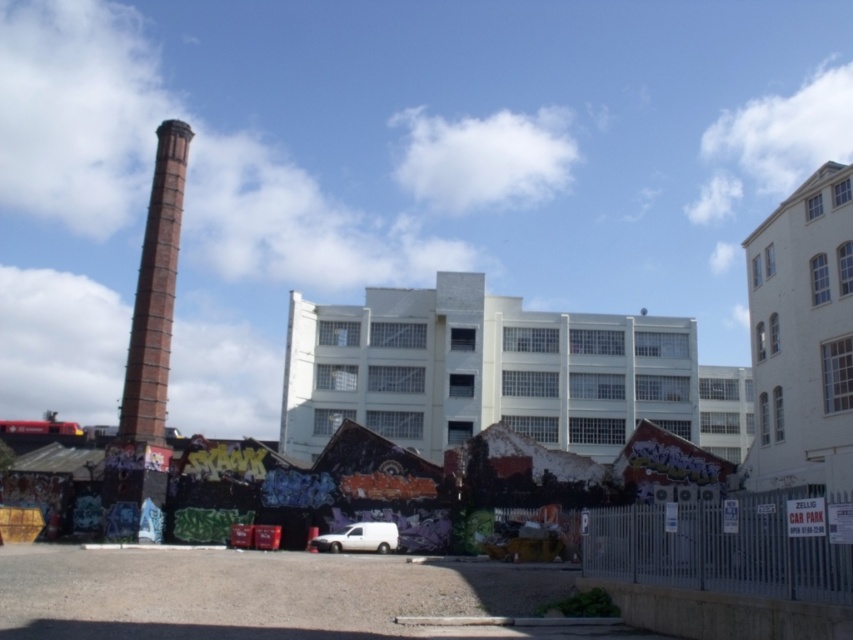
Question: Which object is positioned closest to the red brick chimney at left?

Choices:
 (A) white matte building at center
 (B) white matte van at lower center

Answer: (B)

Question: Which point is farther to the camera?

Choices:
 (A) white matte van at lower center
 (B) white matte building at center

Answer: (B)

Question: Is red brick chimney at left bigger than white matte van at lower center?

Choices:
 (A) no
 (B) yes

Answer: (B)

Question: Which object is farther from the camera taking this photo?

Choices:
 (A) red brick chimney at left
 (B) white matte van at lower center

Answer: (A)

Question: Does white matte building at center have a larger size compared to red brick chimney at left?

Choices:
 (A) no
 (B) yes

Answer: (B)

Question: Does white matte building at center appear under white matte van at lower center?

Choices:
 (A) no
 (B) yes

Answer: (A)